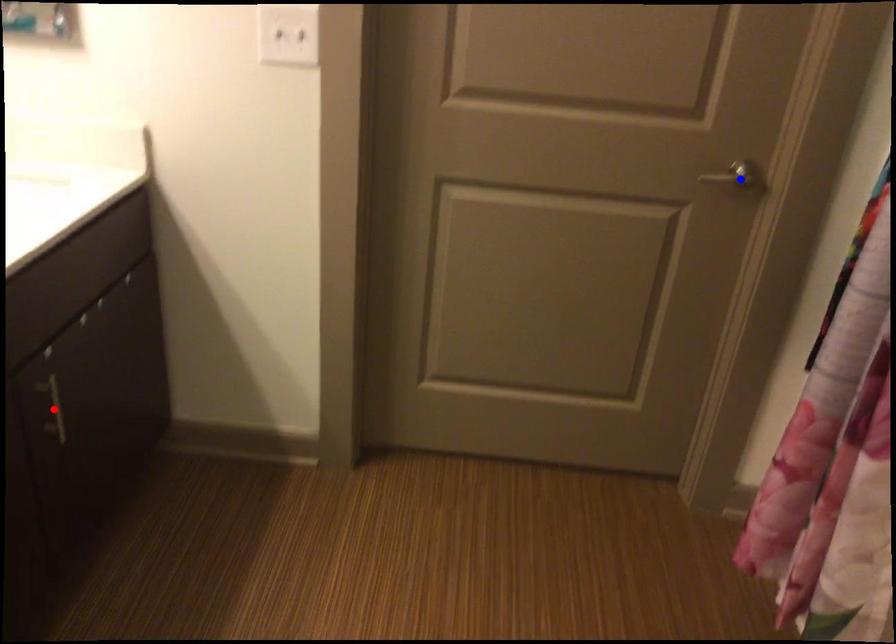
Question: In the image, two points are highlighted. Which point is nearer to the camera? Reply with the corresponding letter.

Choices:
 (A) blue point
 (B) red point

Answer: (B)